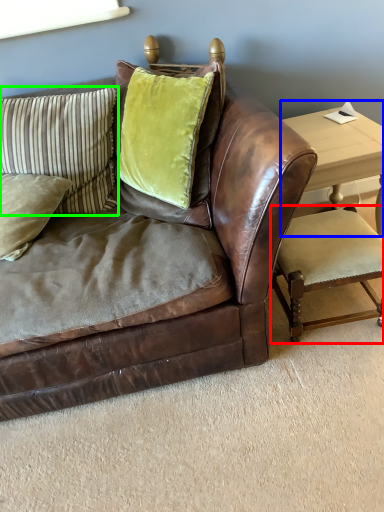
Question: Which is nearer to the armchair (highlighted by a red box)? table (highlighted by a blue box) or pillow (highlighted by a green box).

Choices:
 (A) table
 (B) pillow

Answer: (A)